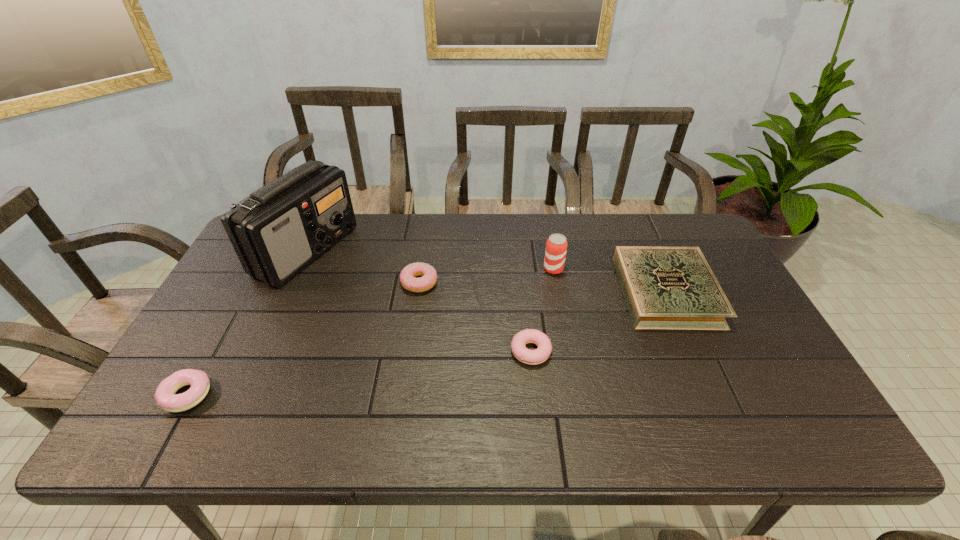
Find the location of a particular element. The image size is (960, 540). object situated at the right edge is located at coordinates (674, 288).

This screenshot has width=960, height=540. What are the coordinates of `object present at the far left corner` in the screenshot? It's located at (277, 231).

You are a GUI agent. You are given a task and a screenshot of the screen. Output one action in this format:
    pyautogui.click(x=<x>, y=<y>)
    Task: Click on the object located at the near left corner
    The width and height of the screenshot is (960, 540).
    Given the screenshot: What is the action you would take?
    pyautogui.click(x=165, y=396)

Locate an element on the screen. The height and width of the screenshot is (540, 960). vacant area at the far edge of the desktop is located at coordinates (373, 237).

This screenshot has width=960, height=540. In order to click on vacant space at the near edge of the desktop in this screenshot , I will do `click(434, 425)`.

This screenshot has height=540, width=960. Identify the location of free location at the left edge. (251, 304).

At what (x,y) coordinates should I click in order to perform the action: click on vacant space at the right edge of the desktop. Please return your answer as a coordinate pair (x, y). Looking at the image, I should click on (726, 367).

Find the location of `vacant region at the far right corner`. vacant region at the far right corner is located at coordinates (711, 256).

Find the location of a particular element. Image resolution: width=960 pixels, height=540 pixels. vacant space at the near right corner is located at coordinates (741, 413).

This screenshot has height=540, width=960. Identify the location of free spot between the leftmost doughnut and the radio receiver. (247, 323).